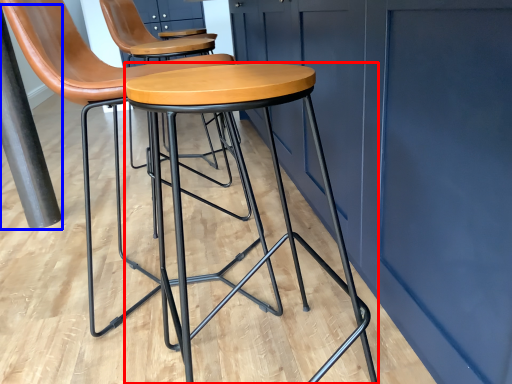
Question: Which object appears farthest to the camera in this image, stool (highlighted by a red box) or pole (highlighted by a blue box)?

Choices:
 (A) stool
 (B) pole

Answer: (B)